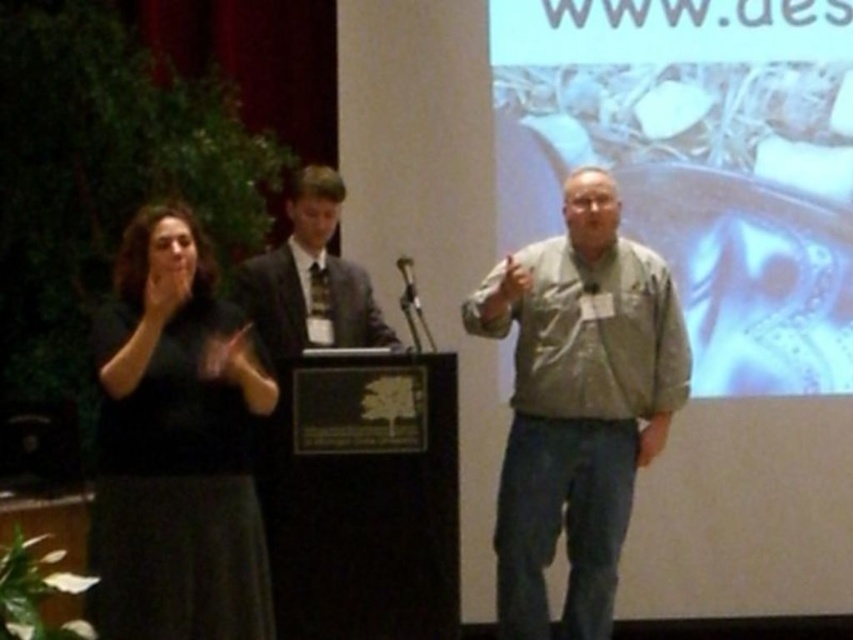
Question: Is black matte dress at left to the left of dark gray suit at center from the viewer's perspective?

Choices:
 (A) no
 (B) yes

Answer: (B)

Question: Can you confirm if black matte dress at left is bigger than dark gray suit at center?

Choices:
 (A) yes
 (B) no

Answer: (A)

Question: Estimate the real-world distances between objects in this image. Which object is farther from the dark gray suit at center?

Choices:
 (A) gray fabric shirt at center
 (B) metallic silver gear at upper right
 (C) black matte dress at left

Answer: (B)

Question: Which is farther from the dark gray suit at center?

Choices:
 (A) metallic silver gear at upper right
 (B) black matte dress at left

Answer: (A)

Question: Which object is farther from the camera taking this photo?

Choices:
 (A) black matte dress at left
 (B) gray fabric shirt at center
 (C) dark gray suit at center
 (D) metallic silver gear at upper right

Answer: (D)

Question: From the image, what is the correct spatial relationship of metallic silver gear at upper right in relation to gray fabric shirt at center?

Choices:
 (A) below
 (B) above

Answer: (B)